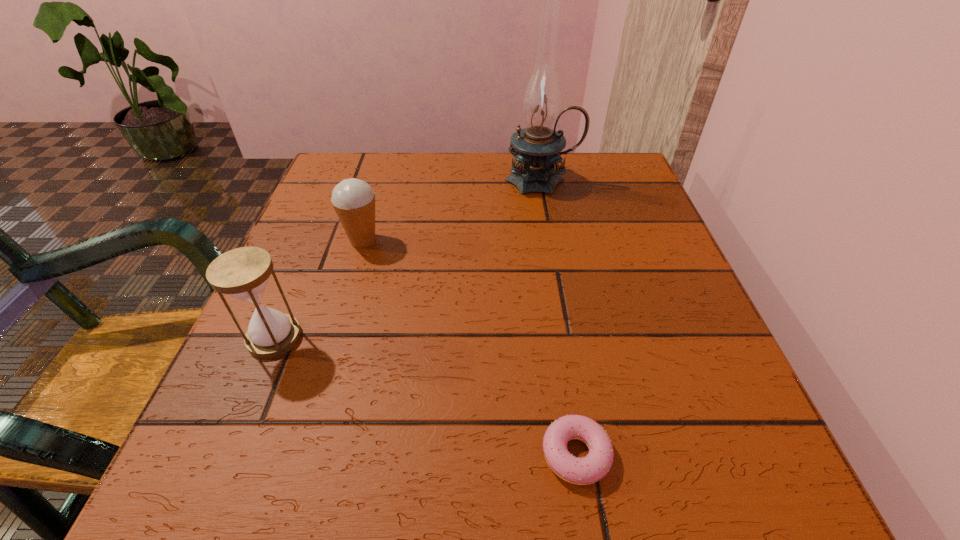
I want to click on the tallest object, so click(x=537, y=148).

I want to click on the farthest object, so click(x=537, y=148).

This screenshot has width=960, height=540. Find the location of `hourglass`. hourglass is located at coordinates (243, 273).

Identify the location of the leftmost object. (243, 273).

Where is `the third object from right to left`? the third object from right to left is located at coordinates (353, 200).

Where is `icecream`? This screenshot has width=960, height=540. icecream is located at coordinates (353, 200).

Image resolution: width=960 pixels, height=540 pixels. What are the coordinates of `doughnut` in the screenshot? It's located at (582, 471).

Where is `the nearest object`? The image size is (960, 540). the nearest object is located at coordinates (582, 471).

You are a GUI agent. You are given a task and a screenshot of the screen. Output one action in this format:
    pyautogui.click(x=<x>, y=<y>)
    Task: Click on the free space located 0.230m on the front of the farthest object
    This screenshot has width=960, height=540.
    Given the screenshot: What is the action you would take?
    pyautogui.click(x=558, y=265)

This screenshot has height=540, width=960. Identify the location of free space located on the back of the second nearest object. (324, 222).